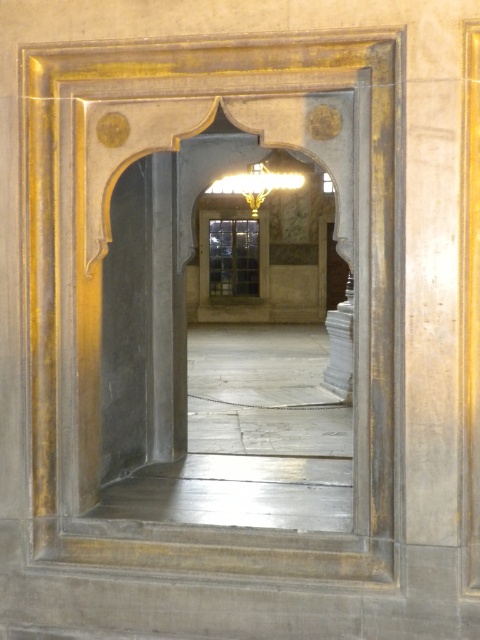
Who is more forward, (312,525) or (271,161)?

Point (312,525) is more forward.

At what (x,y) coordinates should I click in order to perform the action: click on gold polished stone archway at center. Please return your answer as a coordinate pair (x, y). Looking at the image, I should click on (210, 372).